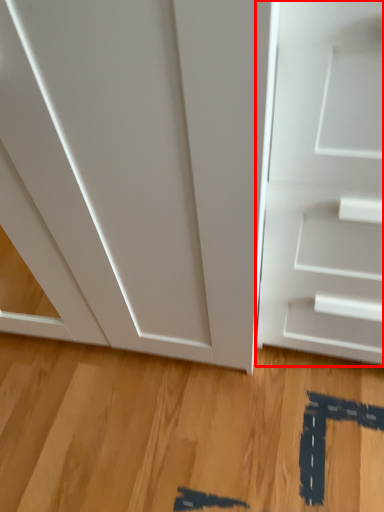
Question: From the image, what is the correct spatial relationship of door (annotated by the red box) in relation to hardwood?

Choices:
 (A) left
 (B) right

Answer: (B)